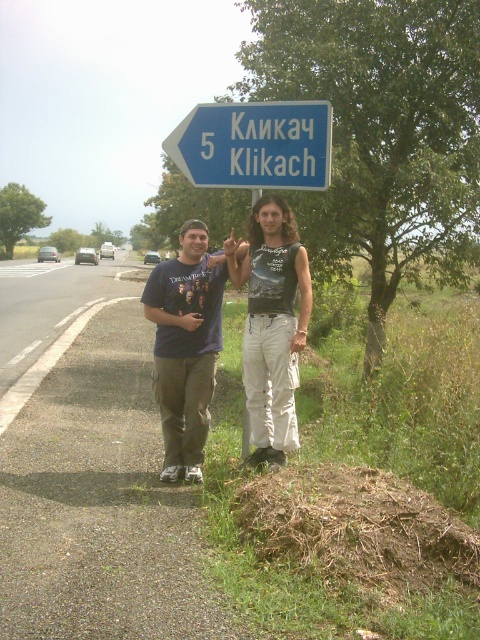
Question: Which point is farther to the camera?

Choices:
 (A) matte blue t-shirt at center
 (B) dark gray sleeveless shirt at center

Answer: (A)

Question: Which point is closer to the camera taking this photo?

Choices:
 (A) (222, 128)
 (B) (292, 257)

Answer: (B)

Question: Does matte blue t-shirt at center have a greater width compared to dark gray sleeveless shirt at center?

Choices:
 (A) no
 (B) yes

Answer: (B)

Question: Is matte blue t-shirt at center thinner than blue plastic sign at upper center?

Choices:
 (A) yes
 (B) no

Answer: (A)

Question: Which object is positioned farthest from the matte blue t-shirt at center?

Choices:
 (A) blue plastic sign at upper center
 (B) dark gray sleeveless shirt at center

Answer: (A)

Question: Is dark gray sleeveless shirt at center to the right of blue plastic sign at upper center from the viewer's perspective?

Choices:
 (A) no
 (B) yes

Answer: (B)